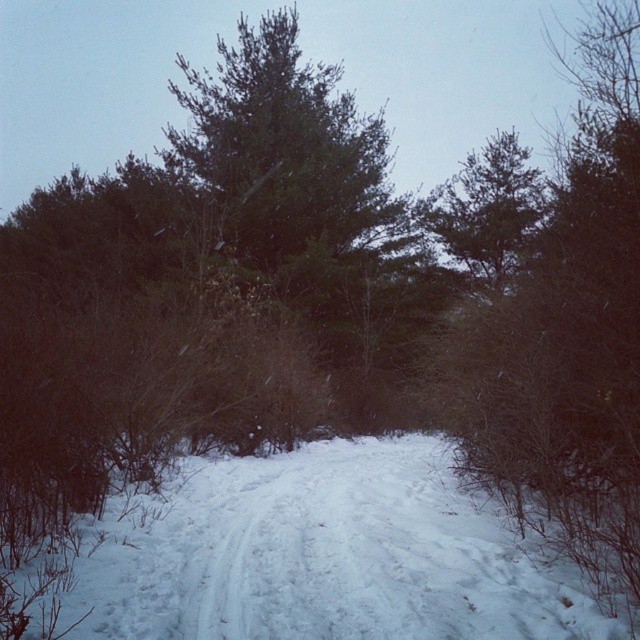
Question: Which of the following is the farthest from the observer?

Choices:
 (A) white powdery snow at center
 (B) green needle-like at upper center

Answer: (B)

Question: Is white powdery snow at center to the right of green needle-like at upper center from the viewer's perspective?

Choices:
 (A) no
 (B) yes

Answer: (A)

Question: Is white powdery snow at center smaller than green needle-like at upper center?

Choices:
 (A) yes
 (B) no

Answer: (A)

Question: Is white powdery snow at center above green needle-like at upper center?

Choices:
 (A) no
 (B) yes

Answer: (A)